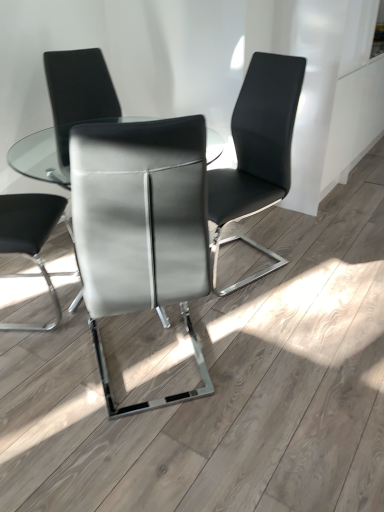
Question: Considering the relative sizes of satin gray leather chair at center, marked as the second chair in a right-to-left arrangement, and clear glass table at center in the image provided, is satin gray leather chair at center, marked as the second chair in a right-to-left arrangement, thinner than clear glass table at center?

Choices:
 (A) yes
 (B) no

Answer: (A)

Question: Can you confirm if satin gray leather chair at center, marked as the second chair in a right-to-left arrangement, is positioned to the right of clear glass table at center?

Choices:
 (A) no
 (B) yes

Answer: (B)

Question: Does satin gray leather chair at center, placed as the 2th chair when sorted from left to right, have a lesser height compared to clear glass table at center?

Choices:
 (A) yes
 (B) no

Answer: (B)

Question: Is satin gray leather chair at center, marked as the second chair in a right-to-left arrangement, positioned before clear glass table at center?

Choices:
 (A) yes
 (B) no

Answer: (A)

Question: From the image's perspective, is satin gray leather chair at center, marked as the second chair in a right-to-left arrangement, on clear glass table at center?

Choices:
 (A) no
 (B) yes

Answer: (A)

Question: Is matte black chair at center, placed as the 3th chair when sorted from left to right, behind clear glass table at center?

Choices:
 (A) yes
 (B) no

Answer: (A)

Question: From the image's perspective, is matte black chair at center, marked as the 1th chair in a right-to-left arrangement, above clear glass table at center?

Choices:
 (A) no
 (B) yes

Answer: (B)

Question: Can you confirm if matte black chair at center, marked as the 1th chair in a right-to-left arrangement, is shorter than clear glass table at center?

Choices:
 (A) no
 (B) yes

Answer: (A)

Question: Is matte black chair at center, placed as the 3th chair when sorted from left to right, smaller than clear glass table at center?

Choices:
 (A) yes
 (B) no

Answer: (A)

Question: From the image's perspective, is matte black chair at center, placed as the 3th chair when sorted from left to right, beneath clear glass table at center?

Choices:
 (A) yes
 (B) no

Answer: (B)

Question: Is matte black chair at center, marked as the 1th chair in a right-to-left arrangement, at the right side of clear glass table at center?

Choices:
 (A) yes
 (B) no

Answer: (A)

Question: Considering the relative positions of clear glass table at center and sleek leather chair at center, which is the third chair from right to left, in the image provided, is clear glass table at center to the left of sleek leather chair at center, which is the third chair from right to left, from the viewer's perspective?

Choices:
 (A) no
 (B) yes

Answer: (A)